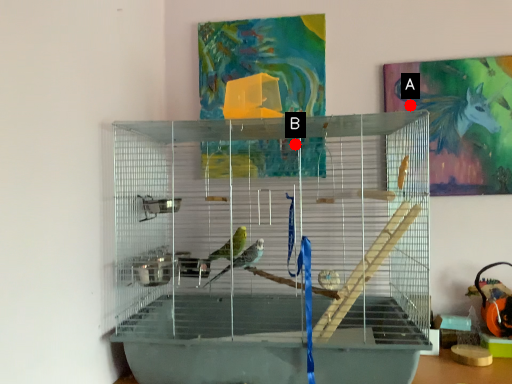
Question: Two points are circled on the image, labeled by A and B beside each circle. Which point appears farthest from the camera in this image?

Choices:
 (A) A is further
 (B) B is further

Answer: (A)